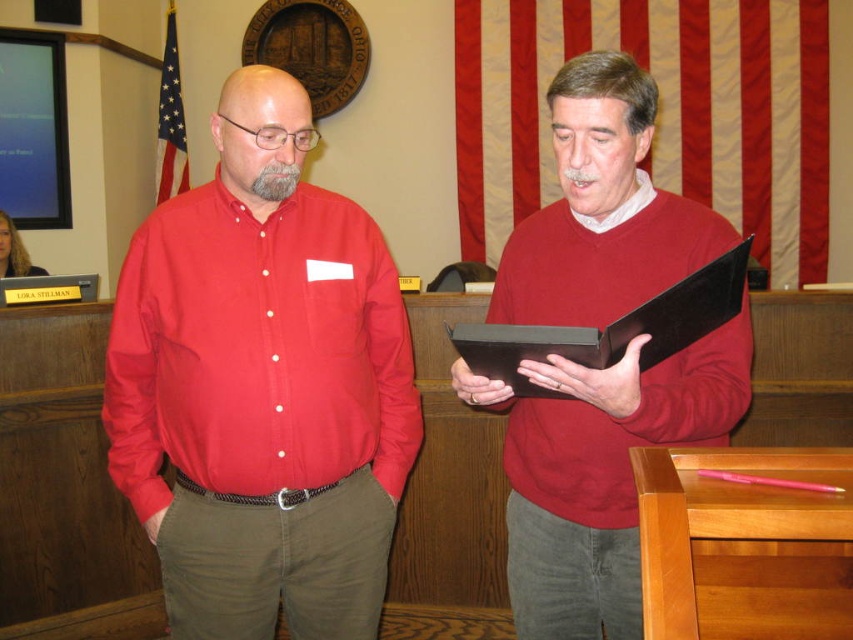
Question: Does matte black folder at center appear on the left side of matte cotton shirt at left?

Choices:
 (A) no
 (B) yes

Answer: (A)

Question: Which of these objects is positioned closest to the matte black folder at center?

Choices:
 (A) black leather clipboard at center
 (B) matte cotton shirt at left

Answer: (A)

Question: Is matte black folder at center closer to camera compared to matte cotton shirt at left?

Choices:
 (A) yes
 (B) no

Answer: (A)

Question: Does matte black folder at center have a larger size compared to black leather clipboard at center?

Choices:
 (A) no
 (B) yes

Answer: (B)

Question: Which point is closer to the camera?

Choices:
 (A) black leather clipboard at center
 (B) matte cotton shirt at left
 (C) matte black folder at center

Answer: (A)

Question: Among these points, which one is farthest from the camera?

Choices:
 (A) (509, 360)
 (B) (622, 221)

Answer: (B)